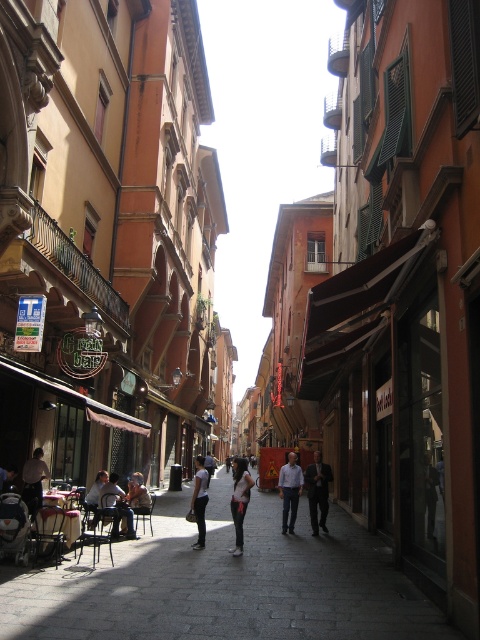
Who is higher up, light blue shirt at center or white matte shirt at center?

light blue shirt at center is above.

Is point (287, 477) closer to viewer compared to point (201, 483)?

No, it is not.

Find the location of `light blue shirt at center`. light blue shirt at center is located at coordinates (289, 490).

Which is below, white fabric bag at center or dark gray shirt at center?

white fabric bag at center is below.

Is white fabric bag at center to the left of dark gray shirt at center from the viewer's perspective?

No, white fabric bag at center is not to the left of dark gray shirt at center.

Who is more distant from viewer, (55, 634) or (34, 500)?

The point (34, 500) is more distant.

What are the coordinates of `white fabric bag at center` in the screenshot? It's located at (225, 582).

Does light brown wooden chair at center have a lesser width compared to matte black jacket at lower left?

In fact, light brown wooden chair at center might be wider than matte black jacket at lower left.

Does light brown wooden chair at center have a greater height compared to matte black jacket at lower left?

Correct, light brown wooden chair at center is much taller as matte black jacket at lower left.

Where is `light brown wooden chair at center`? This screenshot has height=640, width=480. light brown wooden chair at center is located at coordinates (116, 506).